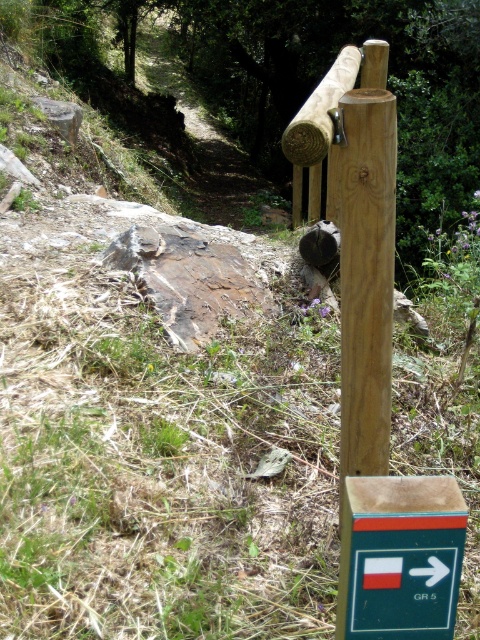
Question: Which point is farther from the camera taking this photo?

Choices:
 (A) 323,93
 (B) 442,481

Answer: (A)

Question: Which of the following is the farthest from the observer?

Choices:
 (A) smooth brown log at upper center
 (B) green plastic sign at center-right

Answer: (A)

Question: Can you confirm if green plastic sign at center-right is bigger than smooth brown log at upper center?

Choices:
 (A) yes
 (B) no

Answer: (B)

Question: Where is green plastic sign at center-right located in relation to smooth brown log at upper center in the image?

Choices:
 (A) below
 (B) above

Answer: (A)

Question: Which object appears closest to the camera in this image?

Choices:
 (A) smooth brown log at upper center
 (B) green plastic sign at center-right

Answer: (B)

Question: Can you confirm if green plastic sign at center-right is positioned to the right of smooth brown log at upper center?

Choices:
 (A) no
 (B) yes

Answer: (A)